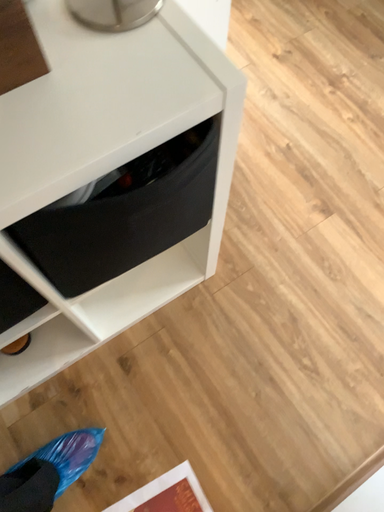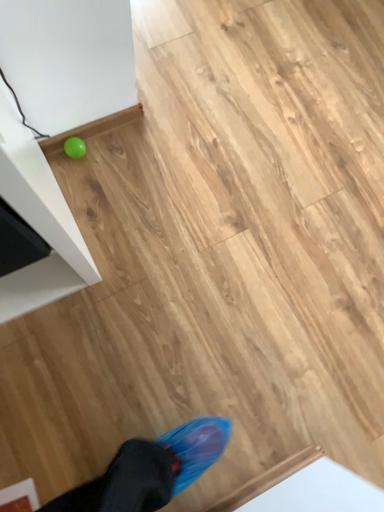
Question: How did the camera likely rotate when shooting the video?

Choices:
 (A) rotated downward
 (B) rotated upward

Answer: (A)